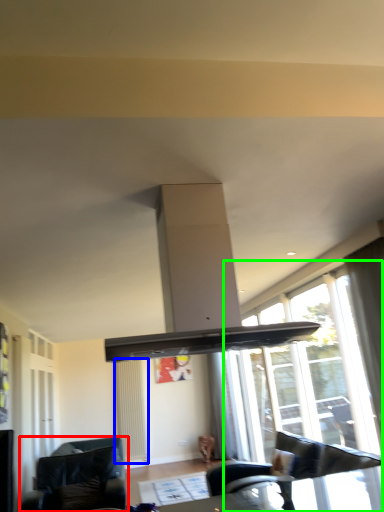
Question: Estimate the real-world distances between objects in this image. Which object is closer to studio couch (highlighted by a red box), radiator (highlighted by a blue box) or window (highlighted by a green box)?

Choices:
 (A) radiator
 (B) window

Answer: (A)